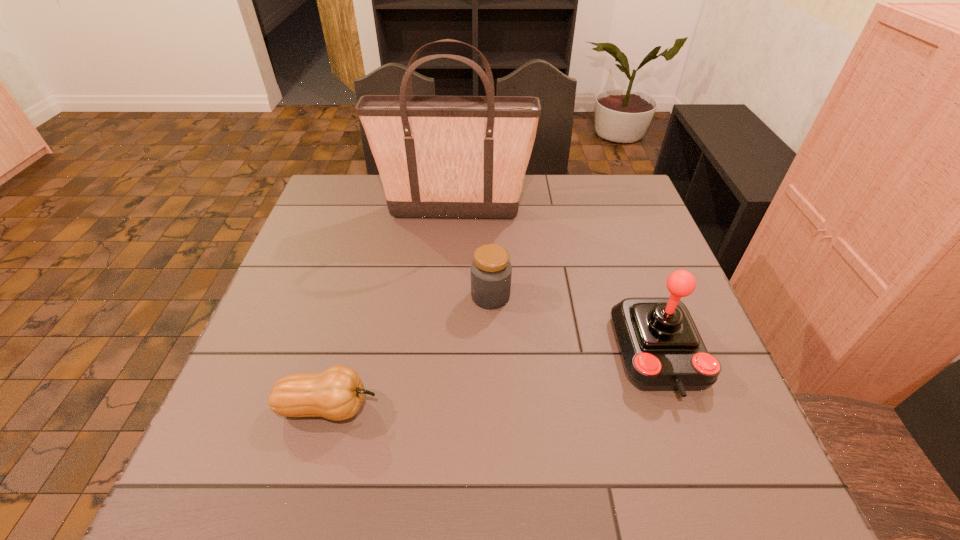
Locate an element on the screen. The width and height of the screenshot is (960, 540). the tallest object is located at coordinates (457, 157).

The height and width of the screenshot is (540, 960). What are the coordinates of `shopping bag` in the screenshot? It's located at (457, 157).

At what (x,y) coordinates should I click in order to perform the action: click on the rightmost object. Please return your answer as a coordinate pair (x, y). The width and height of the screenshot is (960, 540). Looking at the image, I should click on (662, 348).

Image resolution: width=960 pixels, height=540 pixels. I want to click on joystick, so click(662, 348).

This screenshot has width=960, height=540. I want to click on jar, so click(491, 271).

Locate an element on the screen. The image size is (960, 540). gourd is located at coordinates pos(336,394).

Image resolution: width=960 pixels, height=540 pixels. I want to click on vacant space located 0.300m on the front of the tallest object, so click(x=447, y=300).

Image resolution: width=960 pixels, height=540 pixels. In order to click on vacant space situated on the base of the rightmost object in this screenshot , I will do `click(699, 468)`.

Where is `free region located 0.190m on the surface of the second shortest object near the warning symbol`? The height and width of the screenshot is (540, 960). free region located 0.190m on the surface of the second shortest object near the warning symbol is located at coordinates (394, 296).

Find the location of a particular element. Image resolution: width=960 pixels, height=540 pixels. vacant position located on the surface of the second shortest object near the warning symbol is located at coordinates (381, 296).